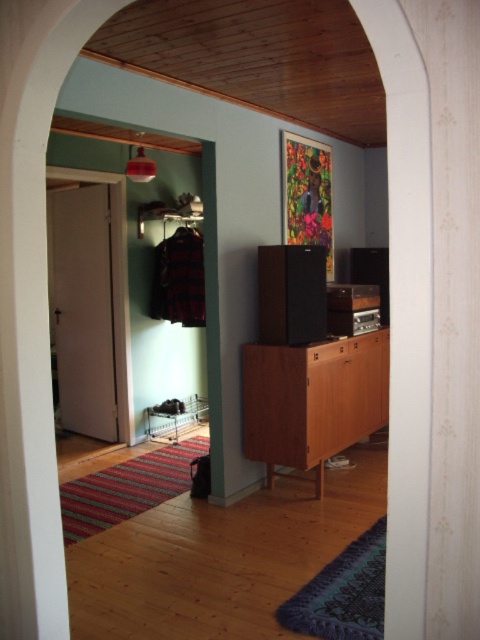
Can you confirm if brown wood cabinet at center is wider than metallic silver rack at lower left?

Yes, brown wood cabinet at center is wider than metallic silver rack at lower left.

Can you confirm if brown wood cabinet at center is positioned to the left of metallic silver rack at lower left?

In fact, brown wood cabinet at center is to the right of metallic silver rack at lower left.

Does point (275, 384) come behind point (154, 413)?

That is False.

Identify the location of brown wood cabinet at center. This screenshot has width=480, height=640. (312, 400).